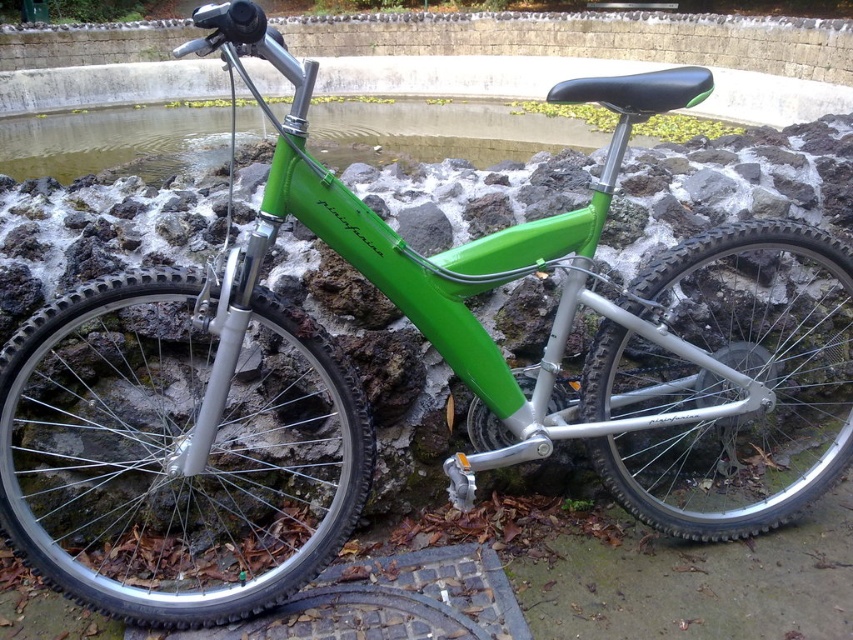
Question: Does green rubber tire at lower left lie in front of green rubber tire at center?

Choices:
 (A) no
 (B) yes

Answer: (B)

Question: Based on their relative distances, which object is nearer to the green rubber tire at lower left?

Choices:
 (A) green matte water at upper center
 (B) green rubber tire at center

Answer: (B)

Question: Is green rubber tire at lower left in front of green rubber tire at center?

Choices:
 (A) no
 (B) yes

Answer: (B)

Question: Which point is farther from the camera taking this photo?

Choices:
 (A) (628, 440)
 (B) (250, 308)

Answer: (A)

Question: Which point is closer to the camera?

Choices:
 (A) green matte water at upper center
 (B) green rubber tire at center

Answer: (B)

Question: From the image, what is the correct spatial relationship of green rubber tire at center in relation to green matte water at upper center?

Choices:
 (A) left
 (B) right

Answer: (B)